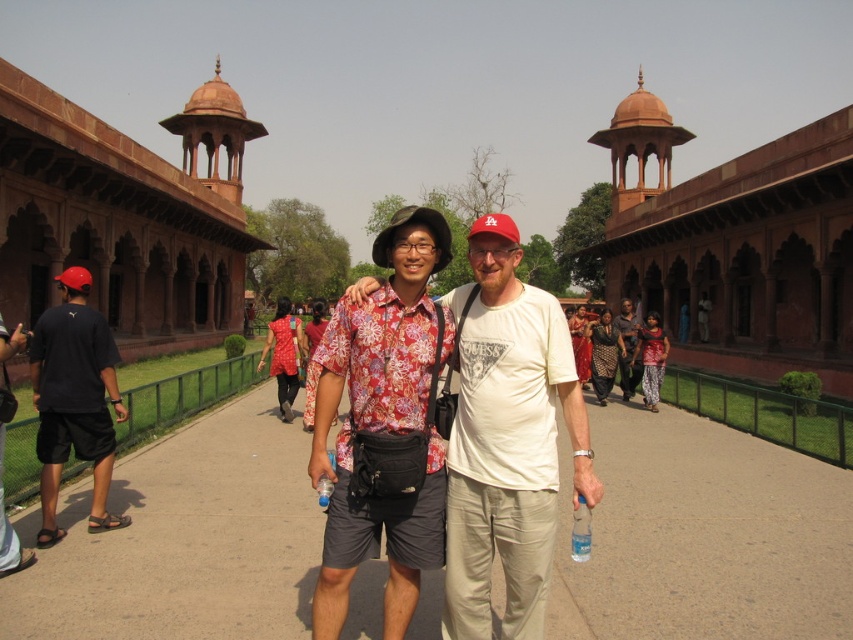
Is red silk sari at center shorter than satin red sari at center?

Correct, red silk sari at center is not as tall as satin red sari at center.

Describe the element at coordinates (604, 355) in the screenshot. The height and width of the screenshot is (640, 853). I see `red silk sari at center` at that location.

Who is more forward, (604, 346) or (578, 312)?

Point (604, 346) is in front.

The width and height of the screenshot is (853, 640). I want to click on red silk sari at center, so click(x=604, y=355).

Consider the image. Does white cotton t-shirt at center have a larger size compared to floral fabric shirt at center?

Correct, white cotton t-shirt at center is larger in size than floral fabric shirt at center.

Between point (585, 477) and point (318, 586), which one is positioned behind?

The point (585, 477) is more distant.

Between point (543, 554) and point (337, 570), which one is positioned in front?

Point (543, 554) is more forward.

This screenshot has width=853, height=640. Identify the location of white cotton t-shirt at center. (508, 440).

Who is lower down, gray concrete pavement at center or red silk sari at center?

gray concrete pavement at center is below.

Can you confirm if gray concrete pavement at center is positioned to the left of red silk sari at center?

Indeed, gray concrete pavement at center is positioned on the left side of red silk sari at center.

Is point (758, 493) farther from camera compared to point (611, 371)?

No, (758, 493) is in front of (611, 371).

Where is `gray concrete pavement at center`? This screenshot has height=640, width=853. gray concrete pavement at center is located at coordinates (703, 536).